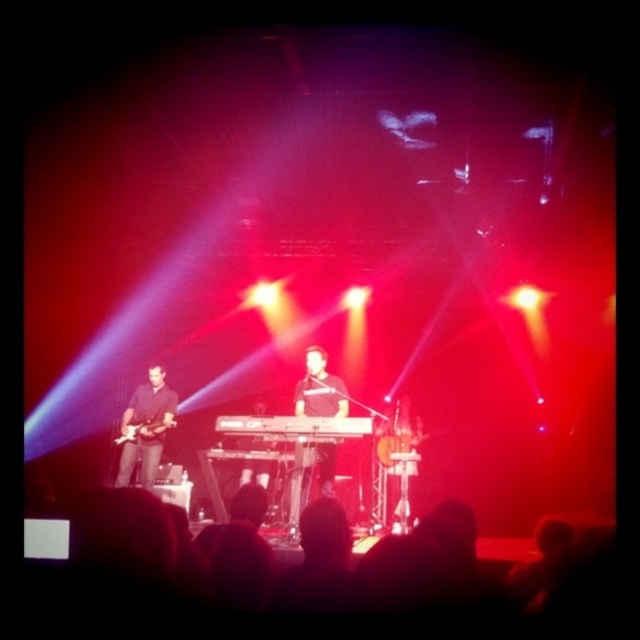
Which is behind, point (305, 362) or point (221, 426)?

The point (305, 362) is more distant.

Does point (326, 464) come closer to viewer compared to point (278, 419)?

No.

Does point (321, 358) come behind point (276, 416)?

No, it is in front of (276, 416).

Identify the location of black matte keyboardist at center. (320, 388).

Can you confirm if black matte guitar at left is bigger than black plastic keyboard at center?

Yes, black matte guitar at left is bigger than black plastic keyboard at center.

Identify the location of black matte guitar at left. The image size is (640, 640). (145, 428).

Does black matte keyboardist at center have a greater height compared to metallic electric guitar at left?

Correct, black matte keyboardist at center is much taller as metallic electric guitar at left.

Is black matte keyboardist at center shorter than metallic electric guitar at left?

No.

Which is behind, point (323, 394) or point (145, 435)?

Positioned behind is point (145, 435).

The width and height of the screenshot is (640, 640). I want to click on black matte keyboardist at center, so click(x=320, y=388).